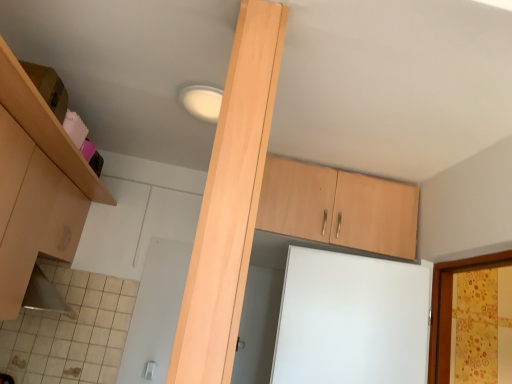
Question: Is matte wood cabinet at upper left, positioned as the 2th cabinetry in right-to-left order, further to the viewer compared to light wood beam at center?

Choices:
 (A) yes
 (B) no

Answer: (B)

Question: Can you confirm if matte wood cabinet at upper left, positioned as the 2th cabinetry in right-to-left order, is taller than light wood beam at center?

Choices:
 (A) no
 (B) yes

Answer: (A)

Question: Does matte wood cabinet at upper left, which is counted as the first cabinetry, starting from the left, have a smaller size compared to light wood beam at center?

Choices:
 (A) yes
 (B) no

Answer: (B)

Question: Can you confirm if matte wood cabinet at upper left, which is counted as the first cabinetry, starting from the left, is thinner than light wood beam at center?

Choices:
 (A) yes
 (B) no

Answer: (B)

Question: Is matte wood cabinet at upper left, positioned as the 2th cabinetry in right-to-left order, in contact with light wood beam at center?

Choices:
 (A) no
 (B) yes

Answer: (A)

Question: From a real-world perspective, is matte wood cabinet at upper left, positioned as the 2th cabinetry in right-to-left order, positioned above or below light wood cabinet at upper center, acting as the first cabinetry starting from the right?

Choices:
 (A) below
 (B) above

Answer: (A)

Question: Is matte wood cabinet at upper left, positioned as the 2th cabinetry in right-to-left order, wider or thinner than light wood cabinet at upper center, the second cabinetry viewed from the left?

Choices:
 (A) wide
 (B) thin

Answer: (B)

Question: Is matte wood cabinet at upper left, which is counted as the first cabinetry, starting from the left, inside or outside of light wood cabinet at upper center, acting as the first cabinetry starting from the right?

Choices:
 (A) outside
 (B) inside

Answer: (A)

Question: From the image's perspective, is matte wood cabinet at upper left, which is counted as the first cabinetry, starting from the left, located above or below light wood cabinet at upper center, the second cabinetry viewed from the left?

Choices:
 (A) below
 (B) above

Answer: (B)

Question: Looking at the image, does light wood cabinet at upper center, acting as the first cabinetry starting from the right, seem bigger or smaller compared to light wood beam at center?

Choices:
 (A) small
 (B) big

Answer: (B)

Question: Is point (x=388, y=220) positioned closer to the camera than point (x=238, y=79)?

Choices:
 (A) closer
 (B) farther

Answer: (B)

Question: From a real-world perspective, relative to light wood beam at center, is light wood cabinet at upper center, the second cabinetry viewed from the left, vertically above or below?

Choices:
 (A) above
 (B) below

Answer: (A)

Question: In the image, is light wood cabinet at upper center, the second cabinetry viewed from the left, positioned in front of or behind light wood beam at center?

Choices:
 (A) behind
 (B) front

Answer: (A)

Question: Considering the relative positions of matte wood cabinet at upper left, which is counted as the first cabinetry, starting from the left, and light wood beam at center in the image provided, is matte wood cabinet at upper left, which is counted as the first cabinetry, starting from the left, to the left or to the right of light wood beam at center?

Choices:
 (A) right
 (B) left

Answer: (B)

Question: Is matte wood cabinet at upper left, which is counted as the first cabinetry, starting from the left, bigger or smaller than light wood beam at center?

Choices:
 (A) small
 (B) big

Answer: (B)